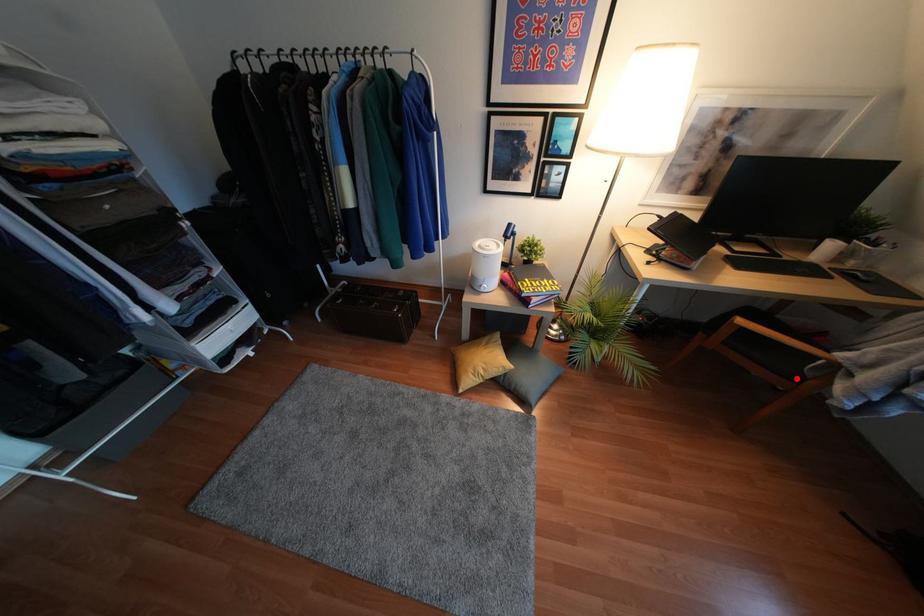
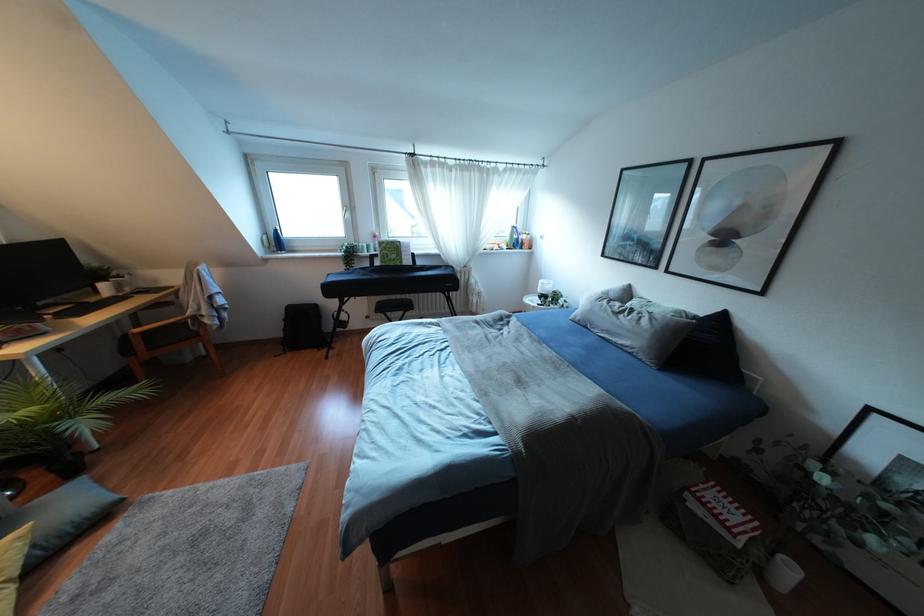
Locate, in the second image, the point that corresponds to the highlighted location in the first image.

(196, 334)